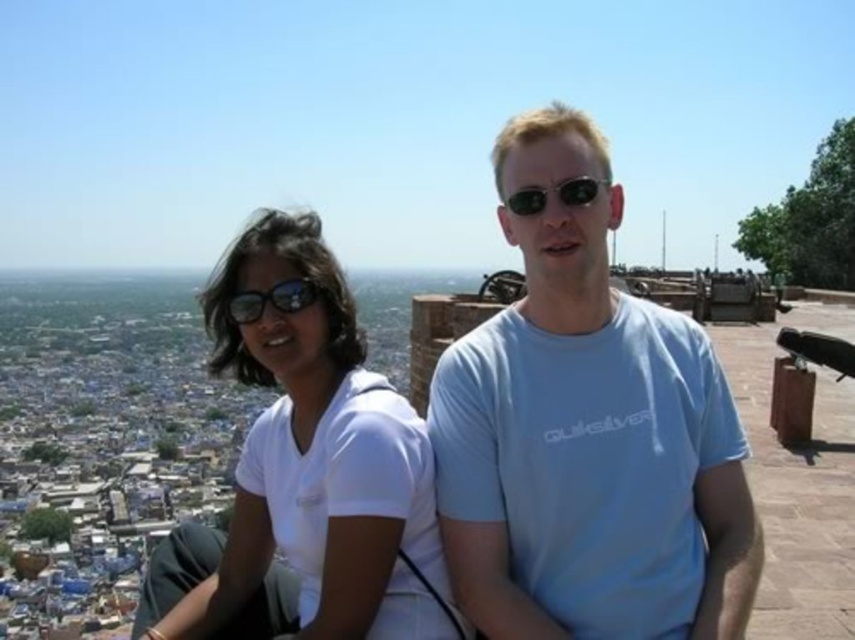
Question: Which object is farther from the camera taking this photo?

Choices:
 (A) black reflective sunglasses at center
 (B) white matte t-shirt at center
 (C) matte black goggles at upper left
 (D) light blue cotton t-shirt at center

Answer: (C)

Question: Which object is farther from the camera taking this photo?

Choices:
 (A) black reflective sunglasses at center
 (B) matte black goggles at upper left

Answer: (B)

Question: Can you confirm if matte black goggles at upper left is positioned above black reflective sunglasses at center?

Choices:
 (A) no
 (B) yes

Answer: (A)

Question: Does white matte t-shirt at center appear on the right side of black reflective sunglasses at center?

Choices:
 (A) no
 (B) yes

Answer: (A)

Question: Which of the following is the closest to the observer?

Choices:
 (A) black reflective sunglasses at center
 (B) matte black goggles at upper left

Answer: (A)

Question: Is white matte t-shirt at center below black reflective sunglasses at center?

Choices:
 (A) yes
 (B) no

Answer: (A)